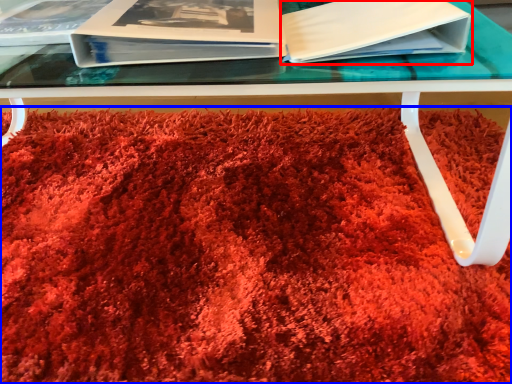
Question: Which of the following is the closest to the observer, paperback book (highlighted by a red box) or blanket (highlighted by a blue box)?

Choices:
 (A) paperback book
 (B) blanket

Answer: (B)